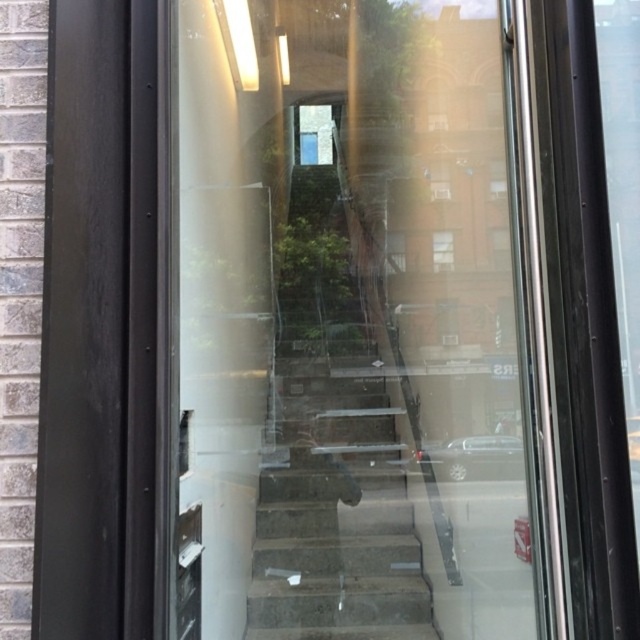
Between transparent glass window at center and clear glass window at center, which one appears on the right side from the viewer's perspective?

transparent glass window at center is more to the right.

Does transparent glass window at center lie in front of clear glass window at center?

That is True.

Is point (442, 243) farther from viewer compared to point (397, 259)?

No, (442, 243) is closer to viewer.

This screenshot has height=640, width=640. In order to click on transparent glass window at center in this screenshot , I will do `click(442, 250)`.

Who is more distant from viewer, (355, 381) or (396, 260)?

The point (396, 260) is more distant.

Is concrete stairs at center to the right of clear glass window at center from the viewer's perspective?

Incorrect, concrete stairs at center is not on the right side of clear glass window at center.

Who is more forward, [392,540] or [403,269]?

Positioned in front is point [392,540].

This screenshot has height=640, width=640. In order to click on concrete stairs at center in this screenshot , I will do `click(333, 509)`.

Identify the location of transparent glass door at center. The height and width of the screenshot is (640, 640). (356, 330).

Between transparent glass door at center and clear glass window at center, which one appears on the left side from the viewer's perspective?

transparent glass door at center is more to the left.

Is point (444, 589) more distant than point (403, 262)?

No.

I want to click on transparent glass door at center, so click(x=356, y=330).